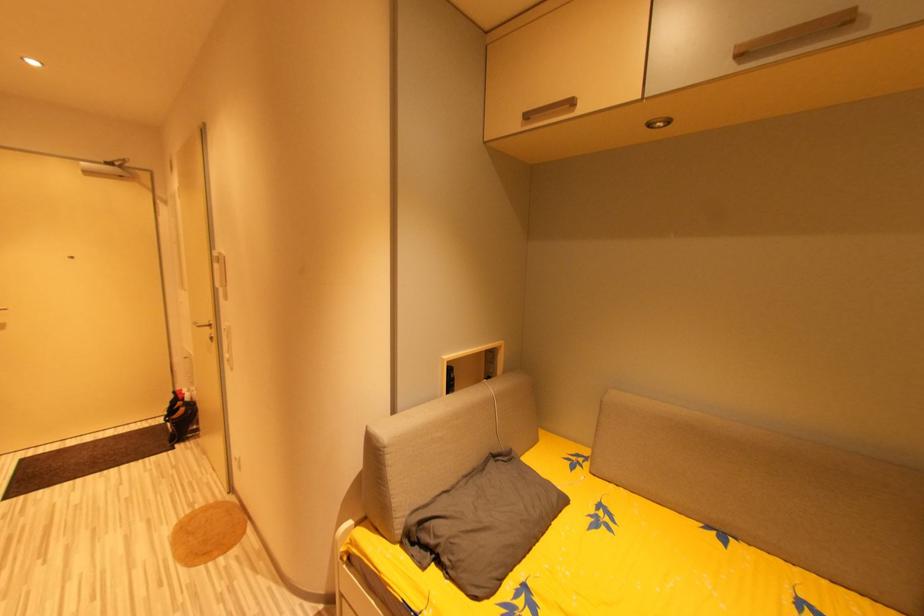
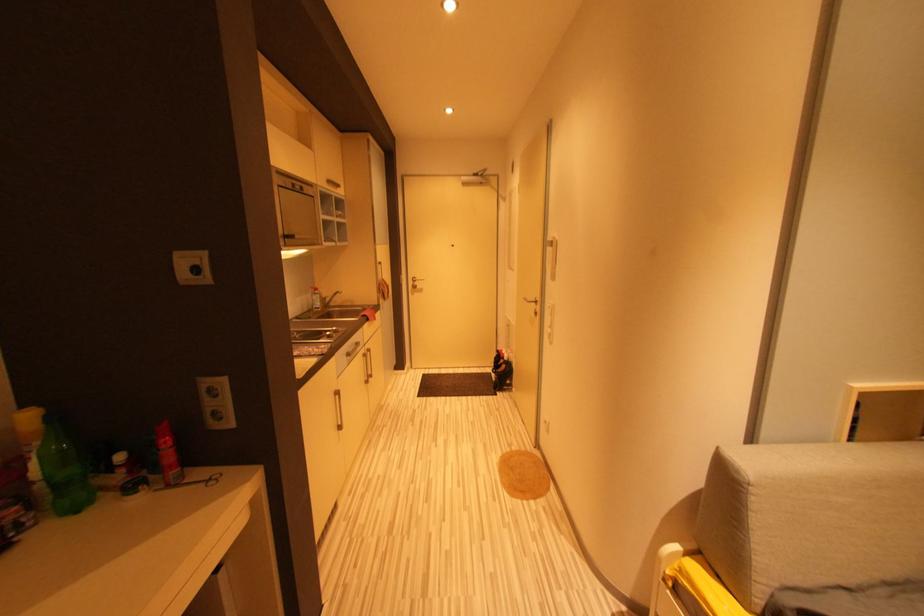
Question: The camera is either moving clockwise (left) or counter-clockwise (right) around the object. The first image is from the beginning of the video and the second image is from the end. Is the camera moving left or right when shooting the video?

Choices:
 (A) Left
 (B) Right

Answer: (B)